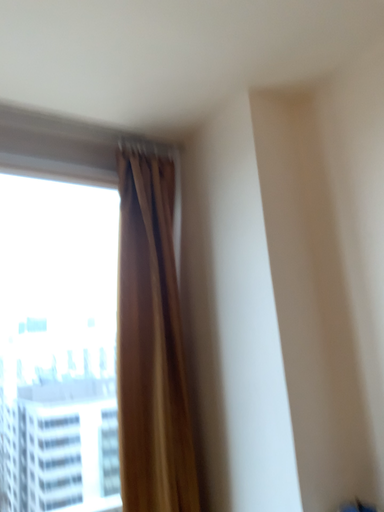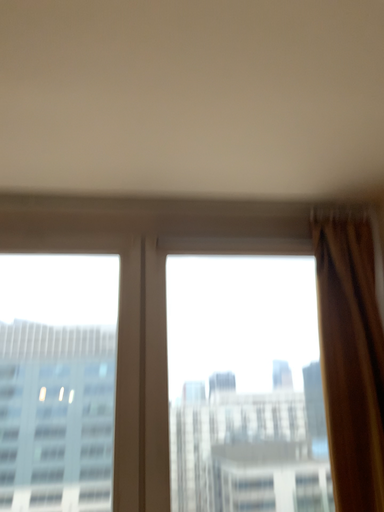
Question: How did the camera likely rotate when shooting the video?

Choices:
 (A) rotated left
 (B) rotated right

Answer: (A)